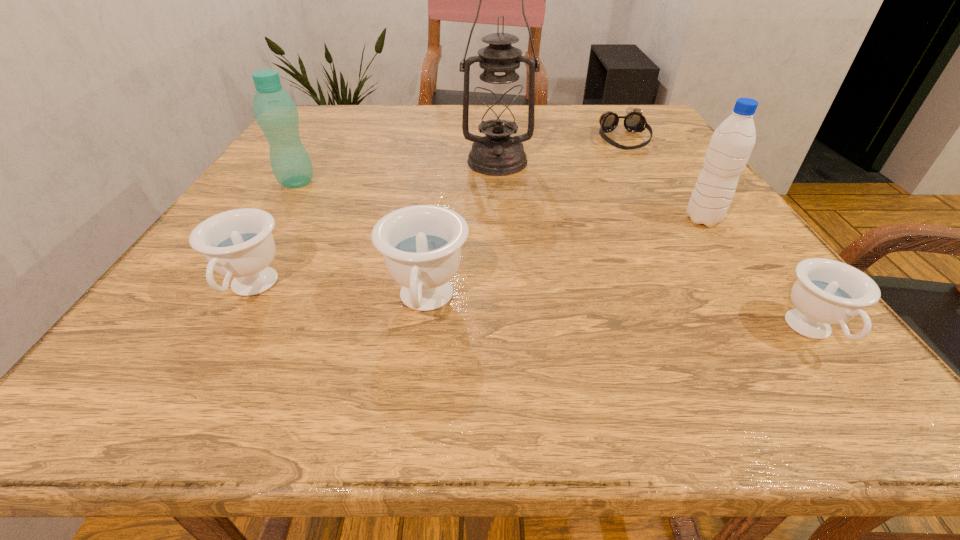
Find the location of a particular element. object that is positioned at the far right corner is located at coordinates 634,121.

This screenshot has height=540, width=960. I want to click on object that is at the near right corner, so click(x=827, y=291).

Find the location of a particular element. vacant space at the far edge of the desktop is located at coordinates (431, 119).

Locate an element on the screen. This screenshot has width=960, height=540. vacant space at the left edge of the desktop is located at coordinates (x=293, y=232).

Find the location of `vacant space at the right edge of the desktop`. vacant space at the right edge of the desktop is located at coordinates (651, 188).

Identify the location of free location at the far right corner of the desktop. (643, 111).

Locate an element on the screen. This screenshot has height=540, width=960. free space between the third shortest object and the oil lamp is located at coordinates (374, 225).

The height and width of the screenshot is (540, 960). I want to click on vacant area that lies between the second teacup from left to right and the shortest teacup, so click(619, 318).

At what (x,y) coordinates should I click in order to perform the action: click on vacant region between the second teacup from left to right and the shortest object. Please return your answer as a coordinate pair (x, y). The height and width of the screenshot is (540, 960). Looking at the image, I should click on (x=524, y=221).

Identify the location of vacant space that is in between the fourth nearest object and the second teacup from left to right. The image size is (960, 540). (564, 261).